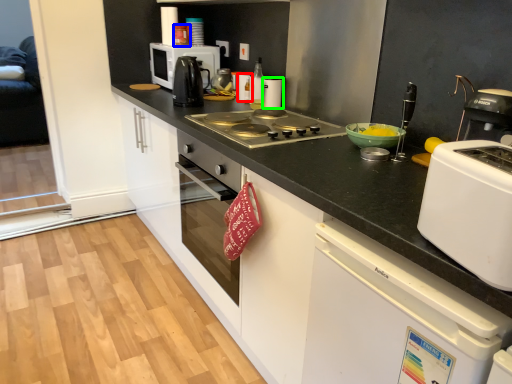
Question: Which object is positioned closest to kitchen appliance (highlighted by a red box)? Select from kitchen appliance (highlighted by a blue box) and kitchen appliance (highlighted by a green box).

Choices:
 (A) kitchen appliance
 (B) kitchen appliance

Answer: (B)